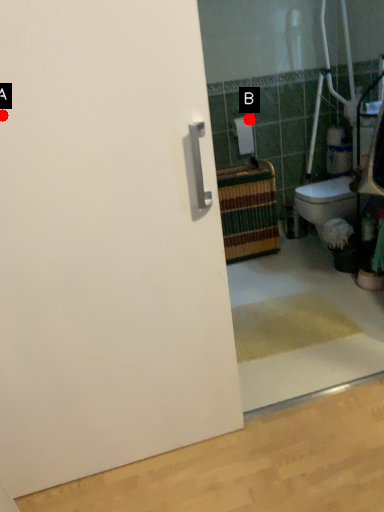
Question: Two points are circled on the image, labeled by A and B beside each circle. Which point appears closest to the camera in this image?

Choices:
 (A) A is closer
 (B) B is closer

Answer: (A)